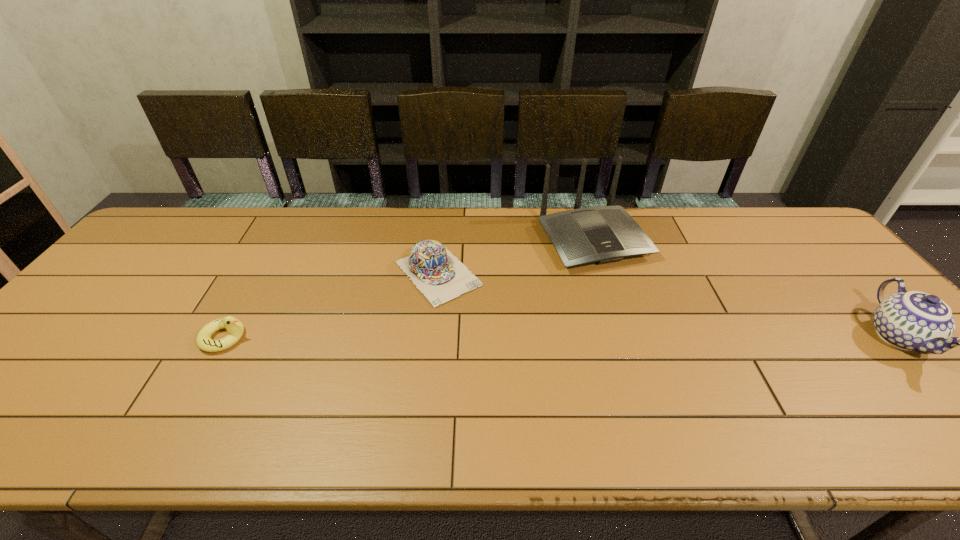
This screenshot has width=960, height=540. I want to click on free location located 0.400m on the front-facing side of the router, so click(699, 391).

Where is `cap present at the far edge`? Image resolution: width=960 pixels, height=540 pixels. cap present at the far edge is located at coordinates (438, 274).

The width and height of the screenshot is (960, 540). I want to click on router at the far edge, so click(604, 234).

At what (x,y) coordinates should I click in order to perform the action: click on vacant space at the far edge. Please return your answer as a coordinate pair (x, y). The height and width of the screenshot is (540, 960). Looking at the image, I should click on (728, 220).

Image resolution: width=960 pixels, height=540 pixels. Find the location of `free space at the near edge of the desktop`. free space at the near edge of the desktop is located at coordinates (186, 386).

This screenshot has height=540, width=960. In the image, there is a desktop. What are the coordinates of `vacant space at the left edge` in the screenshot? It's located at (139, 267).

Locate an element on the screen. This screenshot has height=540, width=960. free space at the right edge is located at coordinates (829, 271).

The width and height of the screenshot is (960, 540). Find the location of `free space at the near left corner of the desktop`. free space at the near left corner of the desktop is located at coordinates (49, 394).

In the image, there is a desktop. Where is `free region at the far right corner`? The image size is (960, 540). free region at the far right corner is located at coordinates (784, 218).

Find the location of a particular element. The image size is (960, 540). free space between the third object from right to left and the duckling is located at coordinates (331, 306).